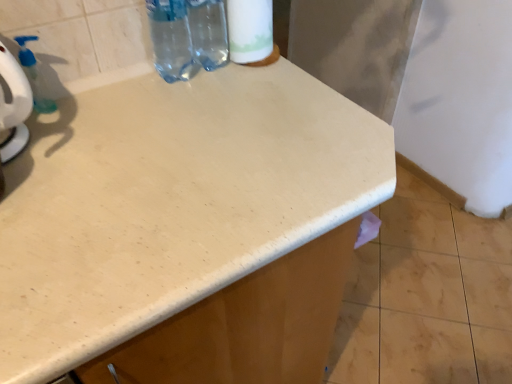
Locate an element on the screen. Image resolution: width=512 pixels, height=384 pixels. vacant space to the right of transparent plastic soap dispenser at upper left is located at coordinates (121, 111).